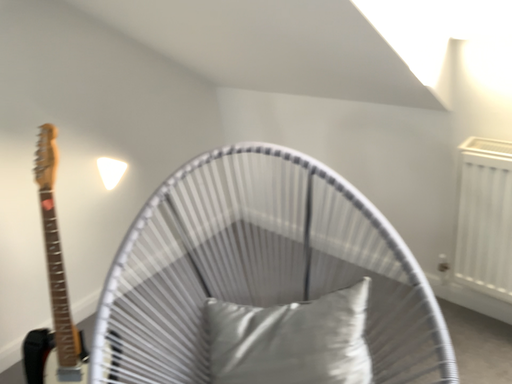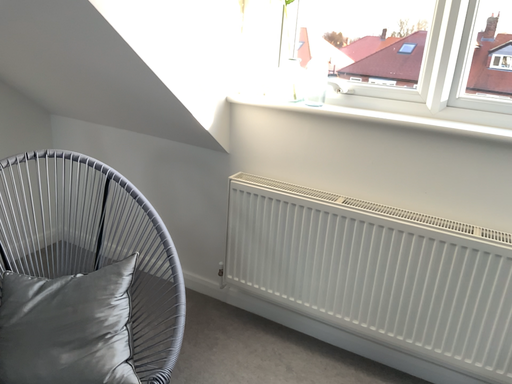
Question: How did the camera likely rotate when shooting the video?

Choices:
 (A) rotated downward
 (B) rotated upward

Answer: (B)